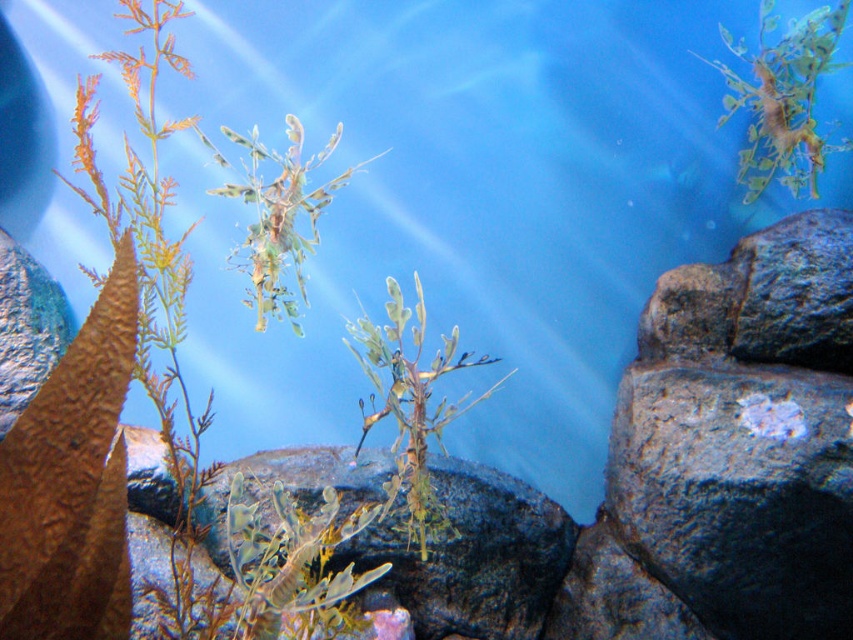
Question: Which object is closer to the camera taking this photo?

Choices:
 (A) green leafy plant at upper right
 (B) brown rough rock at center
 (C) green leafy plant at center
 (D) green translucent plant at center

Answer: (C)

Question: Is green translucent plant at center positioned at the back of green leafy plant at center?

Choices:
 (A) no
 (B) yes

Answer: (B)

Question: Does brown rough rock at center appear on the left side of green translucent plant at center?

Choices:
 (A) yes
 (B) no

Answer: (A)

Question: Estimate the real-world distances between objects in this image. Which object is farther from the brown rough rock at center?

Choices:
 (A) green translucent plant at center
 (B) green leafy plant at upper right
 (C) green leafy plant at center

Answer: (B)

Question: Which point appears farthest from the camera in this image?

Choices:
 (A) (787, 166)
 (B) (444, 419)
 (C) (482, 552)

Answer: (A)

Question: Does green leafy plant at upper right come in front of green translucent plant at center?

Choices:
 (A) no
 (B) yes

Answer: (A)